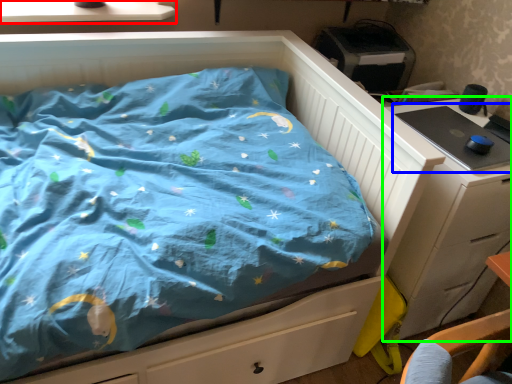
Question: Which is farther away from window sill (highlighted by a red box)? desktop (highlighted by a blue box) or chest of drawers (highlighted by a green box)?

Choices:
 (A) desktop
 (B) chest of drawers

Answer: (B)